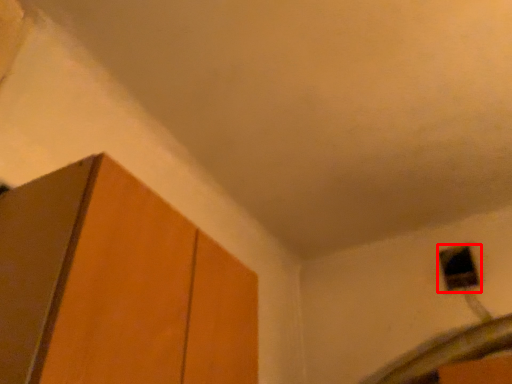
Question: From the image's perspective, what is the correct spatial relationship of window (annotated by the red box) in relation to cabinetry?

Choices:
 (A) above
 (B) below

Answer: (B)